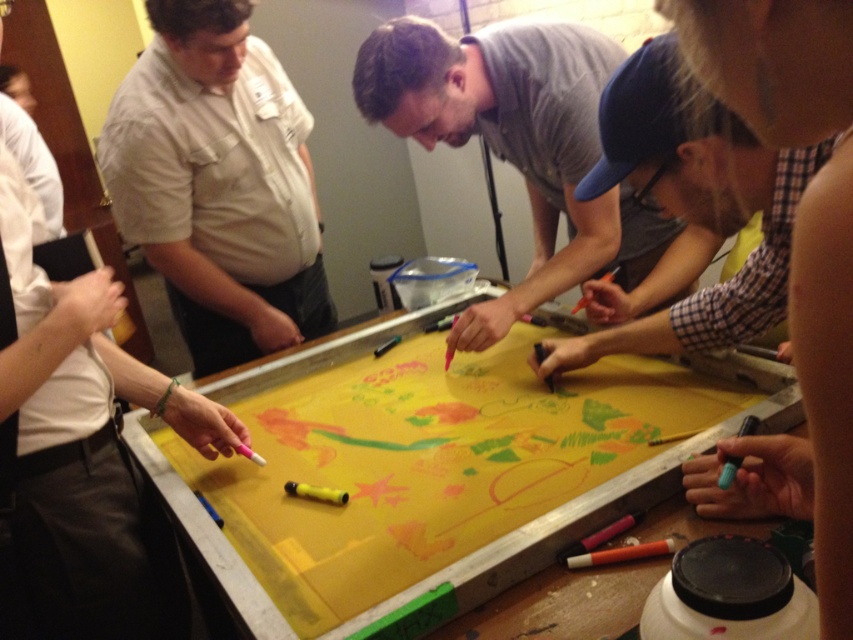
Who is taller, yellow paper at center or orange matte crayon at lower center?

With more height is yellow paper at center.

Which is in front, point (323, 420) or point (660, 541)?

Point (660, 541)

Image resolution: width=853 pixels, height=640 pixels. Find the location of `yellow paper at center`. yellow paper at center is located at coordinates (392, 506).

Which of these two, matte khaki shirt at left or gray matte shirt at center, stands taller?

With more height is matte khaki shirt at left.

Does point (223, 51) come in front of point (399, 64)?

No.

Which is behind, point (260, 250) or point (521, 172)?

The point (260, 250) is behind.

Locate an element on the screen. matte khaki shirt at left is located at coordinates (218, 182).

Does point (285, 129) come farther from viewer compared to point (672, 538)?

That is True.

Does matte khaki shirt at left have a lesser height compared to orange matte crayon at lower center?

In fact, matte khaki shirt at left may be taller than orange matte crayon at lower center.

Between point (271, 180) and point (662, 547), which one is positioned behind?

Point (271, 180)

This screenshot has width=853, height=640. Identify the location of matte khaki shirt at left. (218, 182).